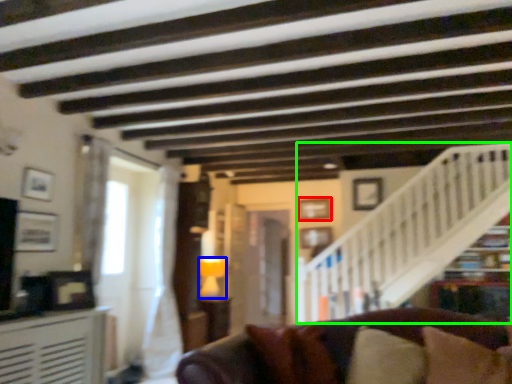
Question: Estimate the real-world distances between objects in this image. Which object is farther from picture frame (highlighted by a red box), lamp (highlighted by a blue box) or stairwell (highlighted by a green box)?

Choices:
 (A) lamp
 (B) stairwell

Answer: (A)